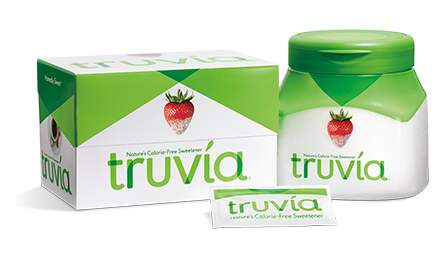
I want to click on plate, so click(x=59, y=147).